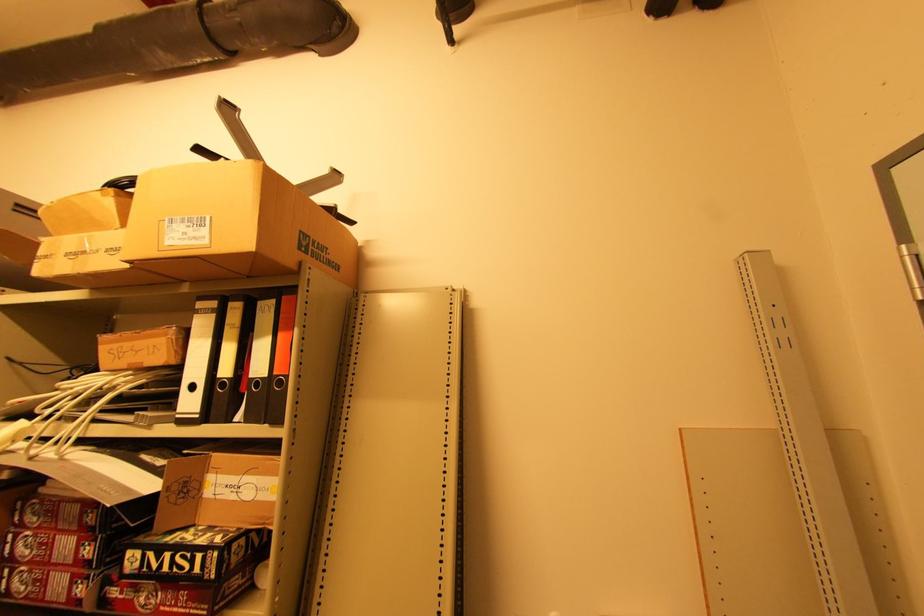
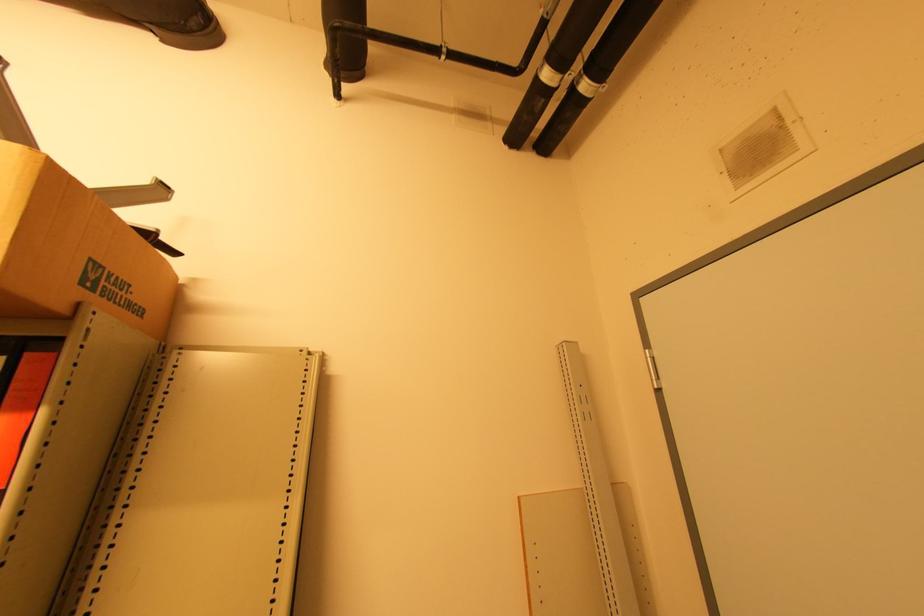
Locate, in the second image, the point that corresponds to the point at 323,55 in the first image.

(165, 42)